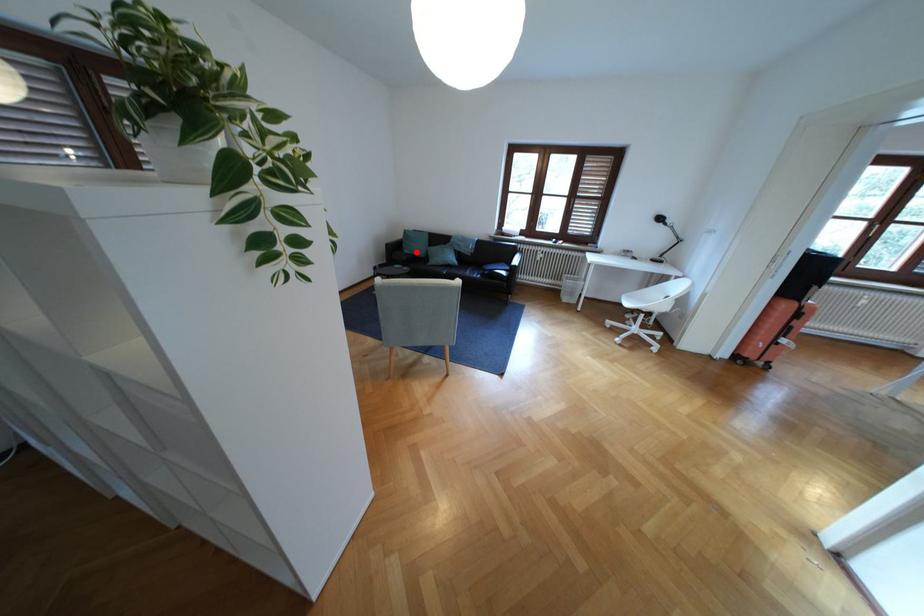
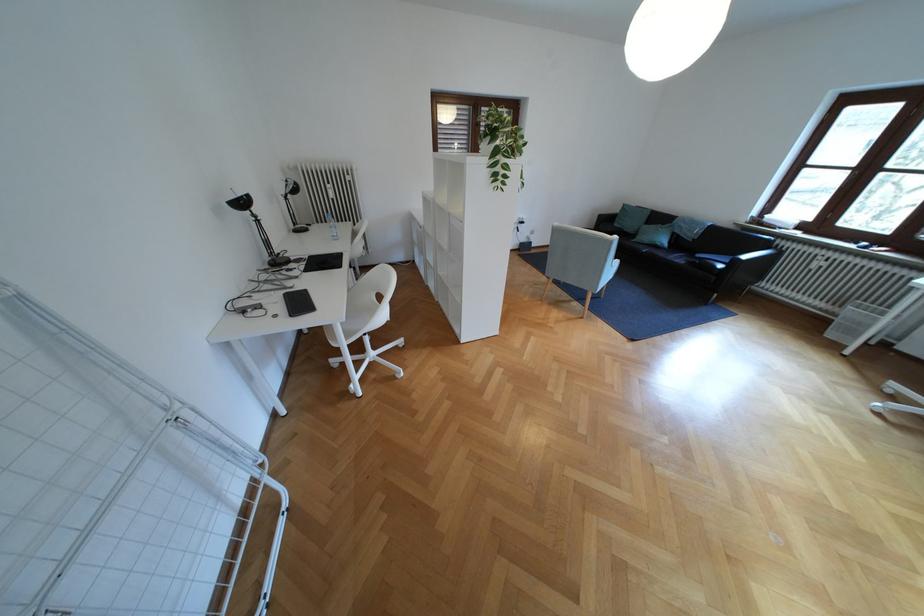
Question: I am providing you with two images of the same scene from different viewpoints. A red point is shown in image1. For the corresponding object point in image2, is it positioned nearer or farther from the camera?

Choices:
 (A) Nearer
 (B) Farther

Answer: (B)